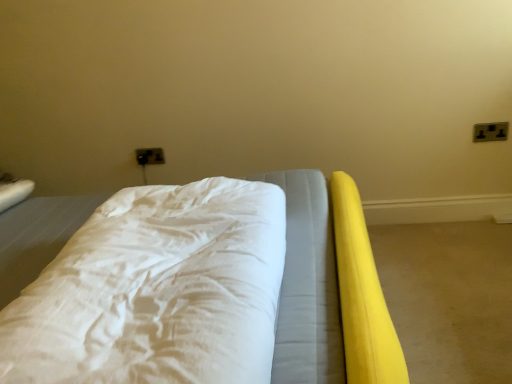
Question: Looking at the image, does black plastic electric outlet at upper right, the first electric outlet positioned from the front, seem bigger or smaller compared to white soft bed at center?

Choices:
 (A) small
 (B) big

Answer: (A)

Question: Is black plastic electric outlet at upper right, which is counted as the first electric outlet, starting from the right, situated inside white soft bed at center or outside?

Choices:
 (A) inside
 (B) outside

Answer: (B)

Question: Considering the real-world distances, which object is farthest from the yellow rubber mat at right?

Choices:
 (A) matte plastic outlet at upper center, positioned as the 1th electric outlet in back-to-front order
 (B) black plastic electric outlet at upper right, the second electric outlet when ordered from left to right
 (C) white soft bed at center

Answer: (A)

Question: Considering the real-world distances, which object is closest to the white soft bed at center?

Choices:
 (A) yellow rubber mat at right
 (B) black plastic electric outlet at upper right, the second electric outlet when ordered from left to right
 (C) matte plastic outlet at upper center, positioned as the 1th electric outlet in back-to-front order

Answer: (A)